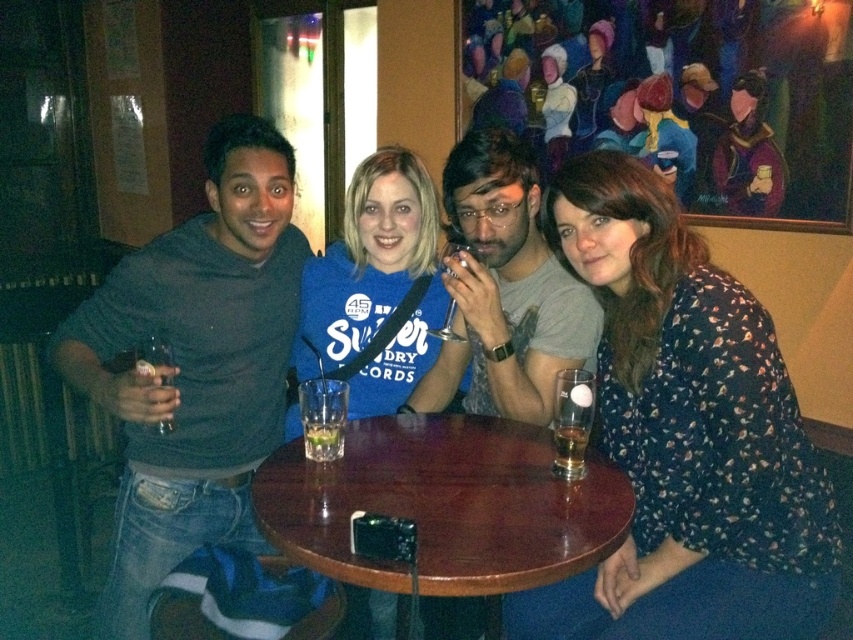
Between gray cotton shirt at left and clear glass at table center, which one has more height?

Standing taller between the two is gray cotton shirt at left.

Can you confirm if gray cotton shirt at left is positioned below clear glass at table center?

No.

Image resolution: width=853 pixels, height=640 pixels. Describe the element at coordinates (195, 364) in the screenshot. I see `gray cotton shirt at left` at that location.

At what (x,y) coordinates should I click in order to perform the action: click on gray cotton shirt at left. Please return your answer as a coordinate pair (x, y). The height and width of the screenshot is (640, 853). Looking at the image, I should click on (195, 364).

From the picture: Is floral-patterned dress at center shorter than wooden at center?

No.

Which is behind, point (740, 637) or point (492, 484)?

Positioned behind is point (492, 484).

Is point (706, 433) positioned in front of point (376, 460)?

Yes, point (706, 433) is in front of point (376, 460).

What are the coordinates of `floral-patterned dress at center` in the screenshot? It's located at (685, 436).

Does point (583, 259) lie behind point (515, 356)?

That is False.

From the picture: Does floral-patterned dress at center have a lesser height compared to matte gray shirt at center?

No.

Is point (790, 618) less distant than point (531, 179)?

That is True.

At what (x,y) coordinates should I click in order to perform the action: click on floral-patterned dress at center. Please return your answer as a coordinate pair (x, y). This screenshot has height=640, width=853. Looking at the image, I should click on (685, 436).